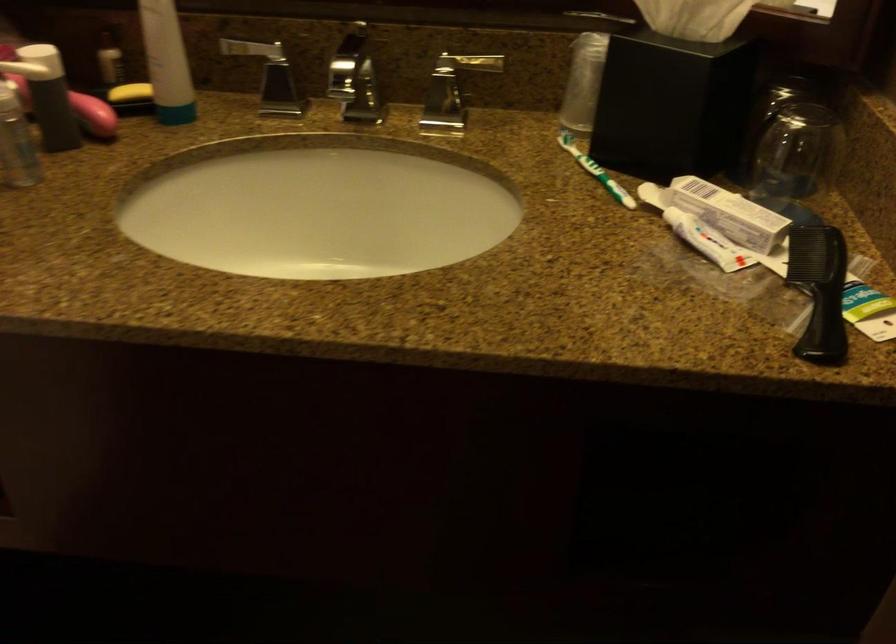
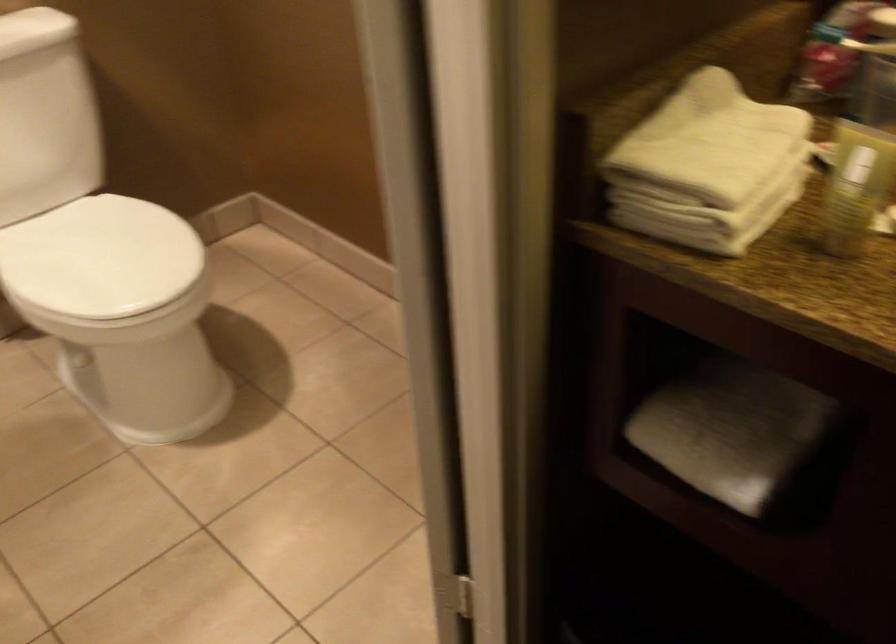
Question: The camera is either moving clockwise (left) or counter-clockwise (right) around the object. The first image is from the beginning of the video and the second image is from the end. Is the camera moving left or right when shooting the video?

Choices:
 (A) Left
 (B) Right

Answer: (B)